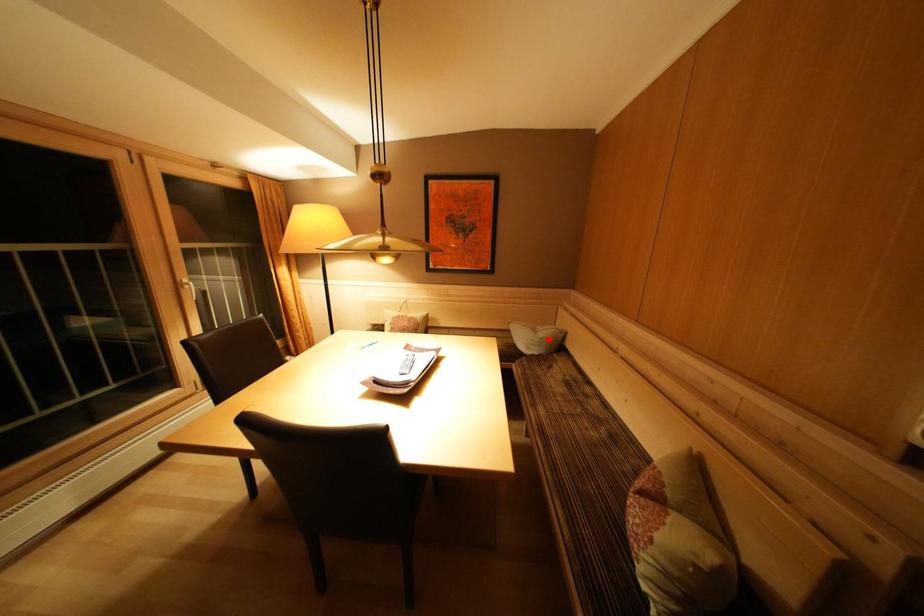
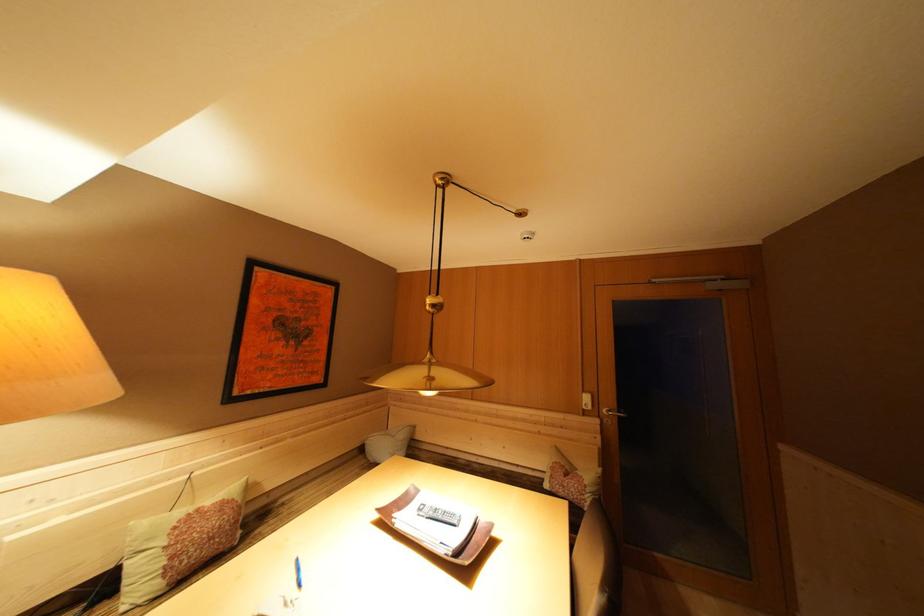
Where in the second image is the point corresponding to the highlighted location from the first image?

(408, 440)